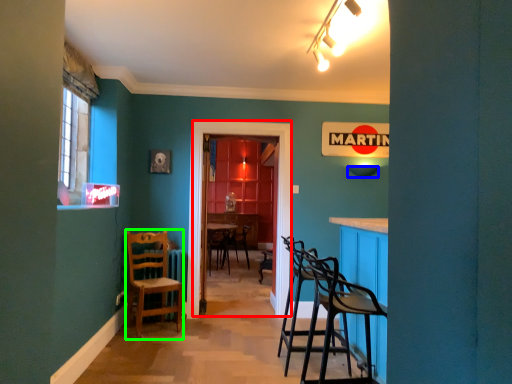
Question: Which is farther away from glass door (highlighted by a red box)? lampshade (highlighted by a blue box) or chair (highlighted by a green box)?

Choices:
 (A) lampshade
 (B) chair

Answer: (A)